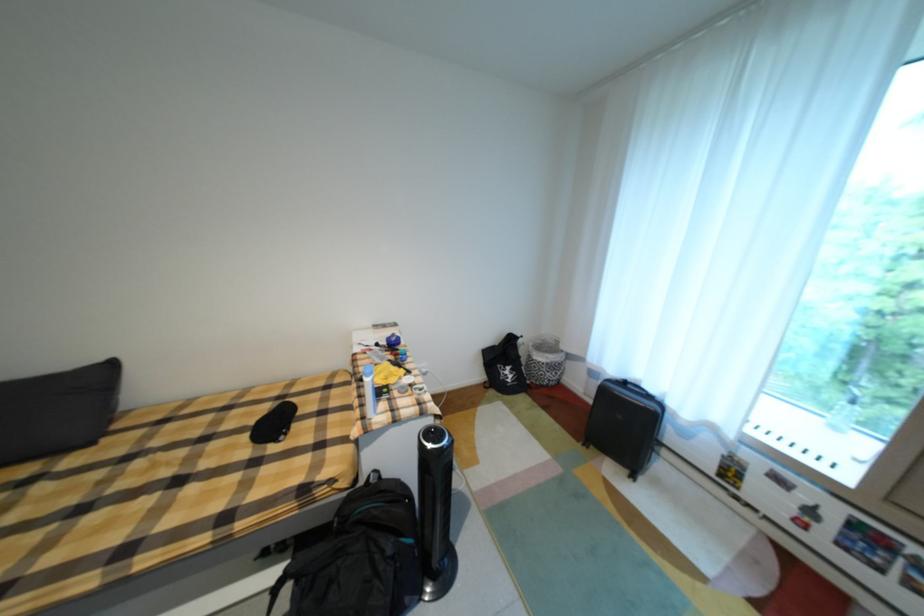
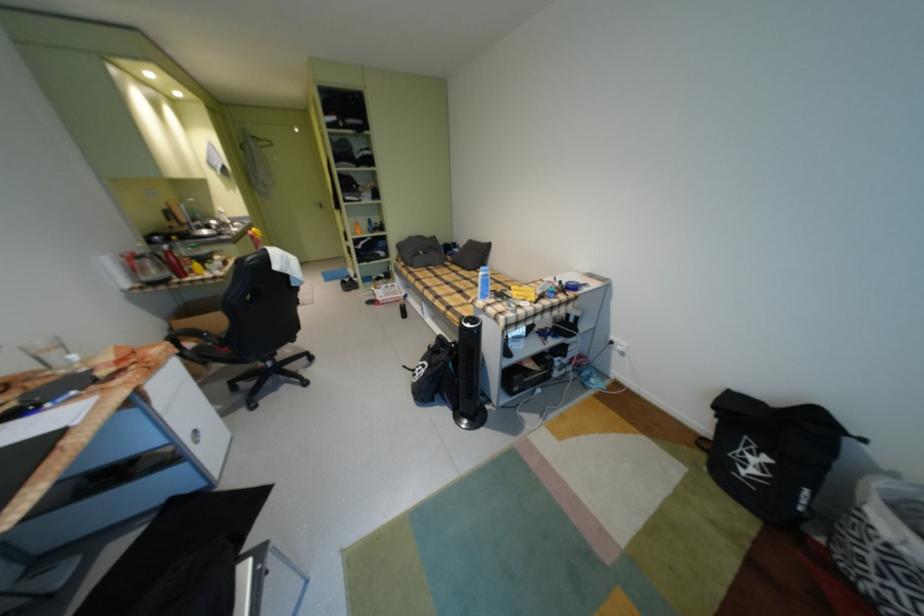
Where in the second image is the point corresponding to point 550,363 from the first image?

(882, 529)